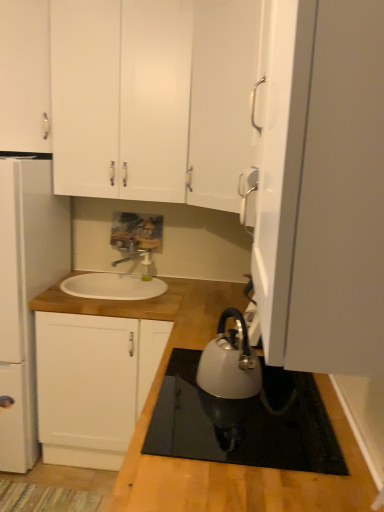
What is the approximate height of silver metallic faucet at center?

The height of silver metallic faucet at center is 7.24 inches.

What is the approximate width of white matte cabinet at upper center, the second cabinetry positioned from the top?

It is 15.60 inches.

What is the approximate width of white matte cabinet at upper left, marked as the first cabinetry in a top-to-bottom arrangement?

white matte cabinet at upper left, marked as the first cabinetry in a top-to-bottom arrangement, is 10.59 inches in width.

What do you see at coordinates (26, 292) in the screenshot?
I see `white matte refrigerator at left` at bounding box center [26, 292].

Identify the location of silver metallic faucet at center. [133, 253].

Does white matte refrigerator at left come behind white matte cabinet at upper center, the second cabinetry positioned from the top?

No, white matte refrigerator at left is closer to the viewer.

In the scene shown: Would you consider white matte refrigerator at left to be distant from white matte cabinet at upper center, the second cabinetry positioned from the top?

No.

Which object is thinner, white matte refrigerator at left or white matte cabinet at upper center, the second cabinetry positioned from the top?

With smaller width is white matte cabinet at upper center, the second cabinetry positioned from the top.

Is point (30, 189) farther from viewer compared to point (126, 81)?

No, (30, 189) is closer to viewer.

Considering the relative sizes of white matte refrigerator at left and white wood cabinet at center, which is counted as the first cabinetry, starting from the bottom, in the image provided, is white matte refrigerator at left thinner than white wood cabinet at center, which is counted as the first cabinetry, starting from the bottom,?

No.

Consider the image. Is white matte refrigerator at left inside the boundaries of white wood cabinet at center, which is counted as the first cabinetry, starting from the bottom, or outside?

white matte refrigerator at left is not enclosed by white wood cabinet at center, which is counted as the first cabinetry, starting from the bottom.

Which is more to the left, white matte refrigerator at left or white wood cabinet at center, which is counted as the first cabinetry, starting from the bottom?

white matte refrigerator at left.

From a real-world perspective, is white matte refrigerator at left physically below white wood cabinet at center, acting as the third cabinetry starting from the top?

No.

Considering the sizes of objects white matte cabinet at upper left, the third cabinetry from the bottom, and silver metallic faucet at center in the image provided, who is smaller, white matte cabinet at upper left, the third cabinetry from the bottom, or silver metallic faucet at center?

With smaller size is silver metallic faucet at center.

From the image's perspective, is white matte cabinet at upper left, marked as the first cabinetry in a top-to-bottom arrangement, below silver metallic faucet at center?

No, from the image's perspective, white matte cabinet at upper left, marked as the first cabinetry in a top-to-bottom arrangement, is not below silver metallic faucet at center.

Is white matte cabinet at upper left, the third cabinetry from the bottom, looking in the opposite direction of silver metallic faucet at center?

No, white matte cabinet at upper left, the third cabinetry from the bottom, is not facing away from silver metallic faucet at center.

Can you confirm if white matte cabinet at upper left, marked as the first cabinetry in a top-to-bottom arrangement, is bigger than white matte refrigerator at left?

No, white matte cabinet at upper left, marked as the first cabinetry in a top-to-bottom arrangement, is not bigger than white matte refrigerator at left.

From a real-world perspective, which is physically below, white matte cabinet at upper left, marked as the first cabinetry in a top-to-bottom arrangement, or white matte refrigerator at left?

From a 3D spatial view, white matte refrigerator at left is below.

From the image's perspective, is white matte cabinet at upper left, marked as the first cabinetry in a top-to-bottom arrangement, above or below white matte refrigerator at left?

Based on their image positions, white matte cabinet at upper left, marked as the first cabinetry in a top-to-bottom arrangement, is located above white matte refrigerator at left.

Is white matte cabinet at upper left, the third cabinetry from the bottom, taller than white matte refrigerator at left?

Incorrect, the height of white matte cabinet at upper left, the third cabinetry from the bottom, is not larger of that of white matte refrigerator at left.

Does white matte cabinet at upper left, the third cabinetry from the bottom, have a greater height compared to white wood cabinet at center, acting as the third cabinetry starting from the top?

In fact, white matte cabinet at upper left, the third cabinetry from the bottom, may be shorter than white wood cabinet at center, acting as the third cabinetry starting from the top.

Does white matte cabinet at upper left, marked as the first cabinetry in a top-to-bottom arrangement, turn towards white wood cabinet at center, acting as the third cabinetry starting from the top?

No, white matte cabinet at upper left, marked as the first cabinetry in a top-to-bottom arrangement, is not oriented towards white wood cabinet at center, acting as the third cabinetry starting from the top.

How far apart are white matte cabinet at upper left, marked as the first cabinetry in a top-to-bottom arrangement, and white wood cabinet at center, acting as the third cabinetry starting from the top?

white matte cabinet at upper left, marked as the first cabinetry in a top-to-bottom arrangement, is 1.18 meters from white wood cabinet at center, acting as the third cabinetry starting from the top.

From the image's perspective, count 2nd cabinetrys downward from the white matte cabinet at upper left, the third cabinetry from the bottom, and point to it. Please provide its 2D coordinates.

[(93, 384)]

Find the location of `kitchen appliance that appears below the white matte cabinet at upper center, the second cabinetry positioned from the top (from a real-world perspective)`. kitchen appliance that appears below the white matte cabinet at upper center, the second cabinetry positioned from the top (from a real-world perspective) is located at coordinates (230, 362).

Is white matte cabinet at upper center, placed as the second cabinetry when sorted from bottom to top, looking in the opposite direction of satin silver kettle at lower center?

white matte cabinet at upper center, placed as the second cabinetry when sorted from bottom to top, is not turned away from satin silver kettle at lower center.

Between white matte cabinet at upper center, placed as the second cabinetry when sorted from bottom to top, and satin silver kettle at lower center, which one has larger size?

Bigger between the two is white matte cabinet at upper center, placed as the second cabinetry when sorted from bottom to top.

Is white wood cabinet at center, acting as the third cabinetry starting from the top, wider or thinner than white matte cabinet at upper center, placed as the second cabinetry when sorted from bottom to top?

Clearly, white wood cabinet at center, acting as the third cabinetry starting from the top, has more width compared to white matte cabinet at upper center, placed as the second cabinetry when sorted from bottom to top.

Is white wood cabinet at center, which is counted as the first cabinetry, starting from the bottom, positioned far away from white matte cabinet at upper center, placed as the second cabinetry when sorted from bottom to top?

Yes.

Does white wood cabinet at center, which is counted as the first cabinetry, starting from the bottom, contain white matte cabinet at upper center, the second cabinetry positioned from the top?

No, white matte cabinet at upper center, the second cabinetry positioned from the top, is located outside of white wood cabinet at center, which is counted as the first cabinetry, starting from the bottom.

Can you confirm if white wood cabinet at center, acting as the third cabinetry starting from the top, is positioned to the right of white matte cabinet at upper center, the second cabinetry positioned from the top?

No.

Locate an element on the screen. The height and width of the screenshot is (512, 384). the 1st cabinetry above when counting from the white matte refrigerator at left (from the image's perspective) is located at coordinates (156, 102).

Identify the location of the 3rd cabinetry behind the white matte refrigerator at left, starting your count from the anchor. (93, 384).

When comparing their distances from white matte cabinet at upper center, placed as the second cabinetry when sorted from bottom to top, does white matte refrigerator at left or silver metallic faucet at center seem closer?

white matte refrigerator at left.

Based on their spatial positions, is silver metallic faucet at center or satin silver kettle at lower center closer to white wood cabinet at center, which is counted as the first cabinetry, starting from the bottom?

silver metallic faucet at center is closer to white wood cabinet at center, which is counted as the first cabinetry, starting from the bottom.

Looking at the image, which one is located further to white matte refrigerator at left, white matte cabinet at upper center, placed as the second cabinetry when sorted from bottom to top, or satin silver kettle at lower center?

satin silver kettle at lower center lies further to white matte refrigerator at left than the other object.

Based on their spatial positions, is silver metallic faucet at center or satin silver kettle at lower center further from white matte cabinet at upper left, the third cabinetry from the bottom?

satin silver kettle at lower center.

Estimate the real-world distances between objects in this image. Which object is closer to white matte cabinet at upper left, the third cabinetry from the bottom, satin silver kettle at lower center or silver metallic faucet at center?

silver metallic faucet at center is positioned closer to the anchor white matte cabinet at upper left, the third cabinetry from the bottom.

From the image, which object appears to be nearer to white matte refrigerator at left, white wood cabinet at center, acting as the third cabinetry starting from the top, or white matte cabinet at upper left, marked as the first cabinetry in a top-to-bottom arrangement?

Among the two, white wood cabinet at center, acting as the third cabinetry starting from the top, is located nearer to white matte refrigerator at left.

From the picture: Estimate the real-world distances between objects in this image. Which object is further from white matte refrigerator at left, white matte cabinet at upper center, the second cabinetry positioned from the top, or white matte cabinet at upper left, marked as the first cabinetry in a top-to-bottom arrangement?

white matte cabinet at upper center, the second cabinetry positioned from the top, is further to white matte refrigerator at left.

Considering their positions, is white wood cabinet at center, acting as the third cabinetry starting from the top, positioned closer to silver metallic faucet at center than white matte cabinet at upper left, the third cabinetry from the bottom?

white wood cabinet at center, acting as the third cabinetry starting from the top, is positioned closer to the anchor silver metallic faucet at center.

Find the location of a particular element. The width and height of the screenshot is (384, 512). tap between white matte cabinet at upper center, the second cabinetry positioned from the top, and white matte refrigerator at left vertically is located at coordinates (133, 253).

The width and height of the screenshot is (384, 512). What are the coordinates of `cabinetry between white matte cabinet at upper left, marked as the first cabinetry in a top-to-bottom arrangement, and white matte refrigerator at left in the up-down direction` in the screenshot? It's located at (156, 102).

Where is `cabinetry between white matte cabinet at upper left, marked as the first cabinetry in a top-to-bottom arrangement, and white wood cabinet at center, which is counted as the first cabinetry, starting from the bottom, in the up-down direction`? The image size is (384, 512). cabinetry between white matte cabinet at upper left, marked as the first cabinetry in a top-to-bottom arrangement, and white wood cabinet at center, which is counted as the first cabinetry, starting from the bottom, in the up-down direction is located at coordinates (156, 102).

At what (x,y) coordinates should I click in order to perform the action: click on tap between white matte cabinet at upper left, the third cabinetry from the bottom, and white wood cabinet at center, which is counted as the first cabinetry, starting from the bottom, in the vertical direction. Please return your answer as a coordinate pair (x, y). Looking at the image, I should click on (133, 253).